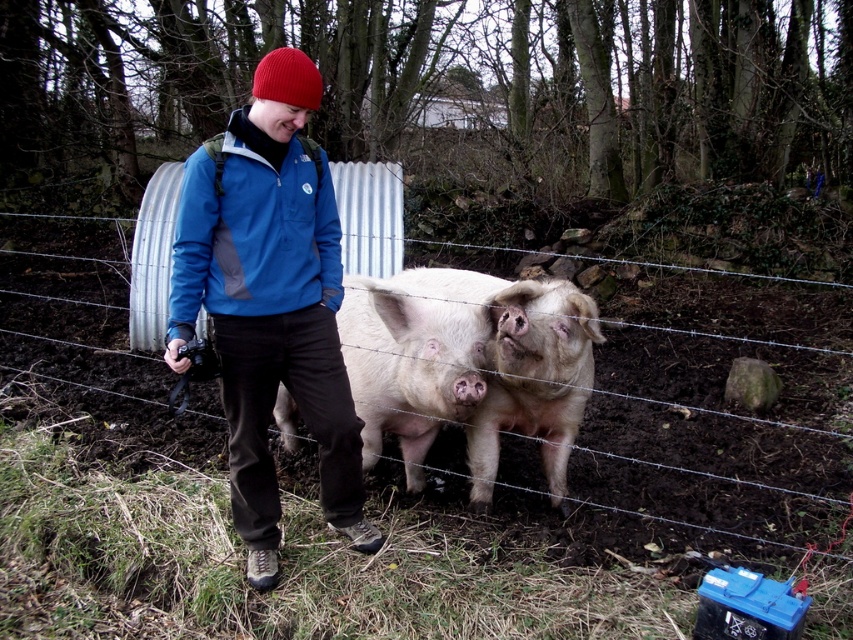
You are a photographer trying to capture the pink soft fur at center without the barbed wire fence at center appearing in the frame. Is it possible to do so by adjusting your camera angle?

The barbed wire fence at center is located above the pink soft fur at center, so if you lower your camera angle to focus on the lower part where the pink soft fur at center is positioned, you can avoid the barbed wire fence at center appearing in the frame.

Based on the photo, you are standing at the center of the image and want to walk towards the barbed wire fence at center. In which direction should you move?

The barbed wire fence at center is located at point 0.708 on the x and 0.824 on the y axis, so you should move towards the lower right direction to reach it.

You are a photographer trying to capture a wide shot of the barbed wire fence at center and the blue fleece jacket at center. Which object should you focus on first if you want to ensure both are in the frame without moving the camera?

The barbed wire fence at center is bigger than the blue fleece jacket at center, so you should focus on the barbed wire fence at center first to ensure it fits in the frame, then adjust to include the smaller blue fleece jacket at center.